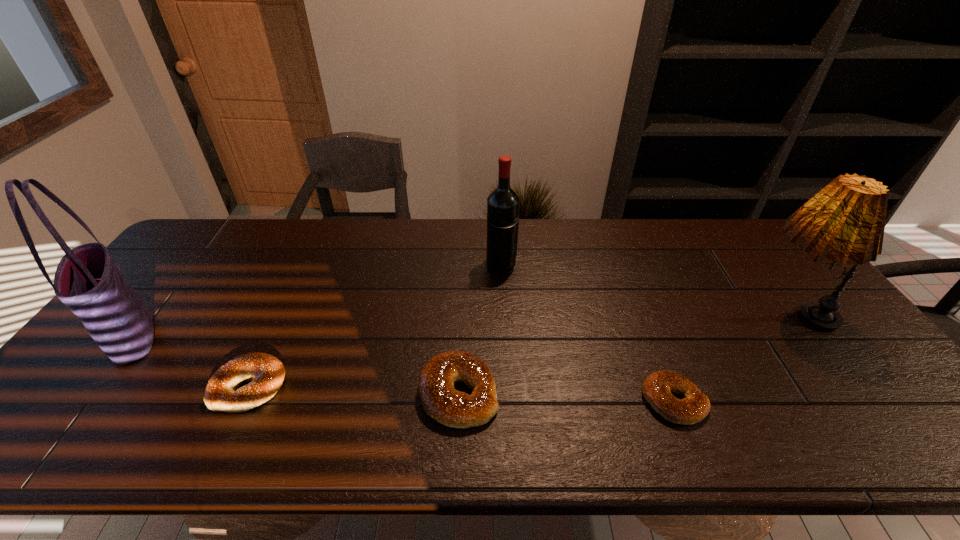
In order to click on free region located on the right of the second object from right to left in this screenshot , I will do `click(847, 401)`.

The height and width of the screenshot is (540, 960). Identify the location of free space located on the left of the wine bottle. (380, 264).

The height and width of the screenshot is (540, 960). I want to click on vacant area located on the front-facing side of the lampshade, so pos(726,312).

You are a GUI agent. You are given a task and a screenshot of the screen. Output one action in this format:
    pyautogui.click(x=<x>, y=<y>)
    Task: Click on the vacant space located 0.140m on the front-facing side of the lampshade
    
    Given the screenshot: What is the action you would take?
    pyautogui.click(x=697, y=312)

Where is `vacant area situated on the front-facing side of the lampshade`? The width and height of the screenshot is (960, 540). vacant area situated on the front-facing side of the lampshade is located at coordinates (612, 312).

Locate an element on the screen. This screenshot has height=540, width=960. free space located 0.350m on the back of the leftmost object is located at coordinates (211, 238).

Find the location of a particular element. The height and width of the screenshot is (540, 960). object located in the far edge section of the desktop is located at coordinates (503, 202).

Locate an element on the screen. object present at the left edge is located at coordinates (87, 280).

You are a GUI agent. You are given a task and a screenshot of the screen. Output one action in this format:
    pyautogui.click(x=<x>, y=<y>)
    Task: Click on the object positioned at the right edge
    Image resolution: width=960 pixels, height=540 pixels.
    Given the screenshot: What is the action you would take?
    pyautogui.click(x=844, y=222)

Find the location of a particular element. This screenshot has height=540, width=960. free spot at the far edge of the desktop is located at coordinates [x=289, y=244].